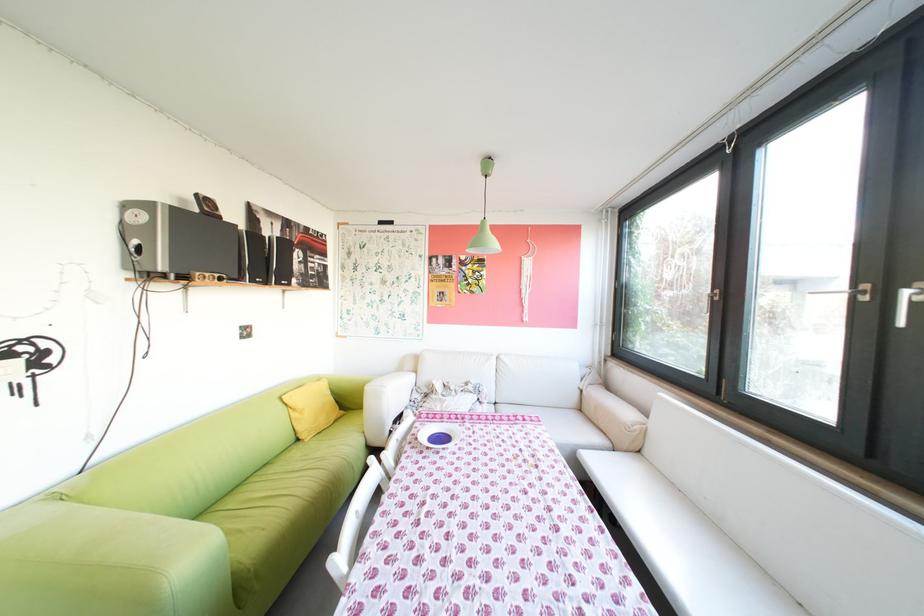
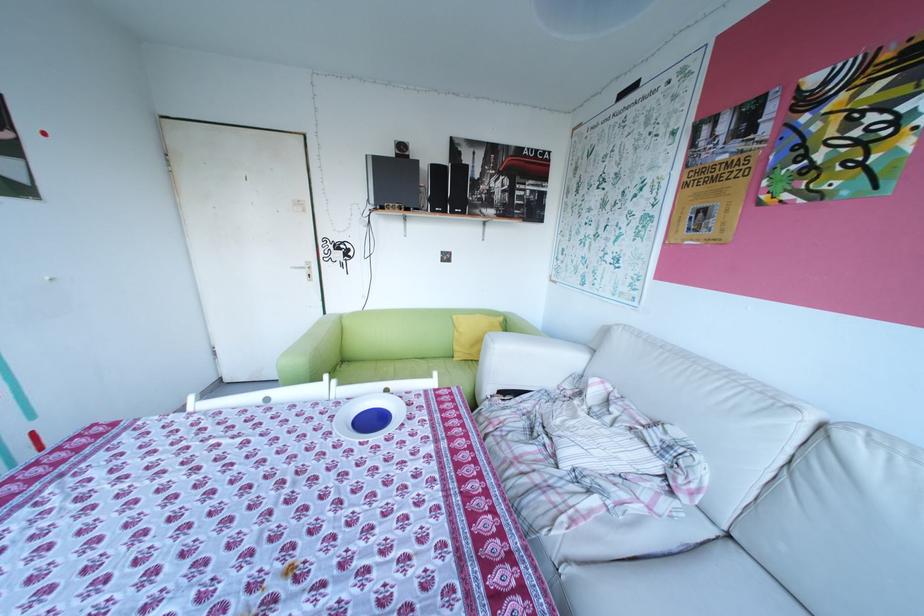
Locate, in the second image, the point that corresponds to [292,284] in the first image.

(466, 212)